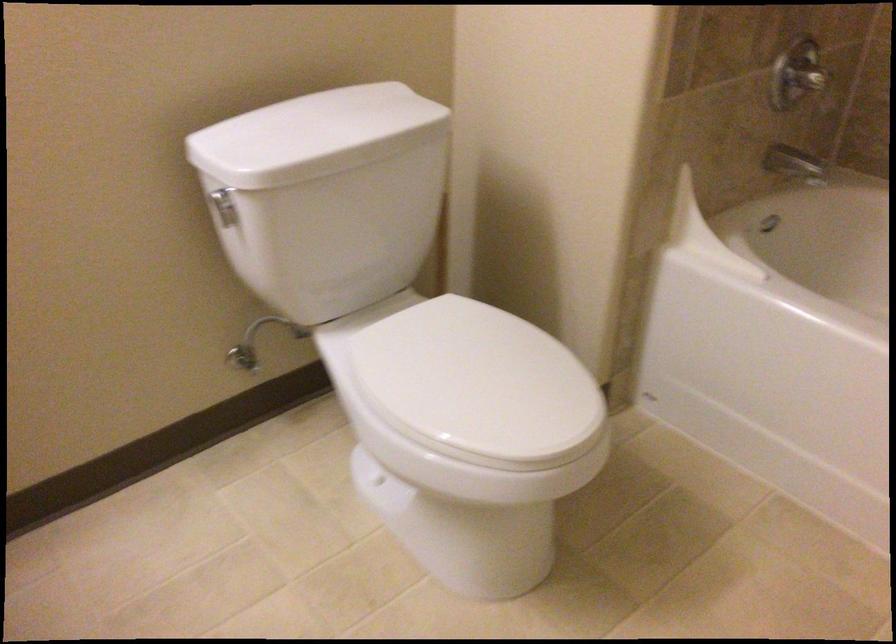
The width and height of the screenshot is (896, 644). Describe the element at coordinates (224, 205) in the screenshot. I see `the toilet flush handle` at that location.